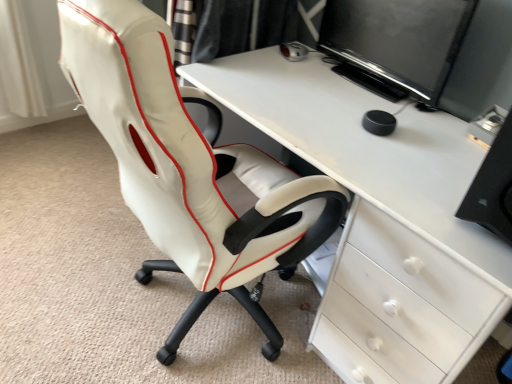
Where is `vacant space underneath black glossy monitor at upper right (from a real-world perspective)`? This screenshot has height=384, width=512. vacant space underneath black glossy monitor at upper right (from a real-world perspective) is located at coordinates (372, 84).